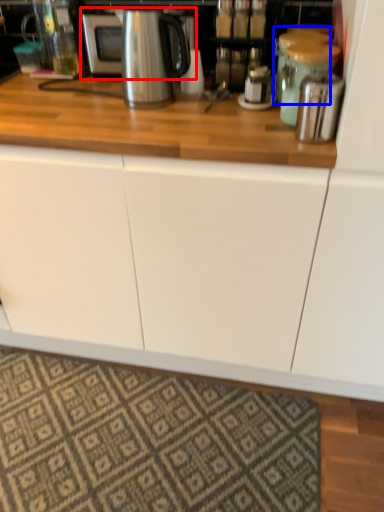
Question: Among these objects, which one is farthest to the camera, microwave (highlighted by a red box) or appliance (highlighted by a blue box)?

Choices:
 (A) microwave
 (B) appliance

Answer: (A)